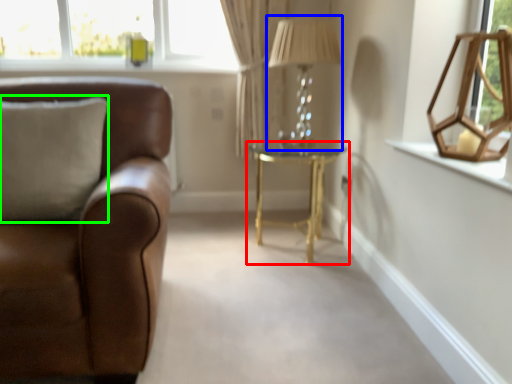
Question: Considering the real-world distances, which object is farthest from table (highlighted by a red box)? table lamp (highlighted by a blue box) or pillow (highlighted by a green box)?

Choices:
 (A) table lamp
 (B) pillow

Answer: (B)